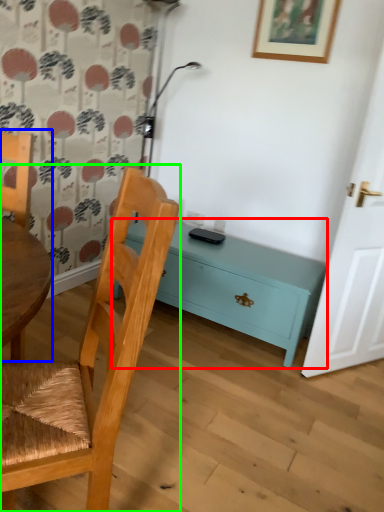
Question: Which object is positioned closest to nightstand (highlighted by a red box)? Select from chair (highlighted by a blue box) and chair (highlighted by a green box).

Choices:
 (A) chair
 (B) chair

Answer: (A)